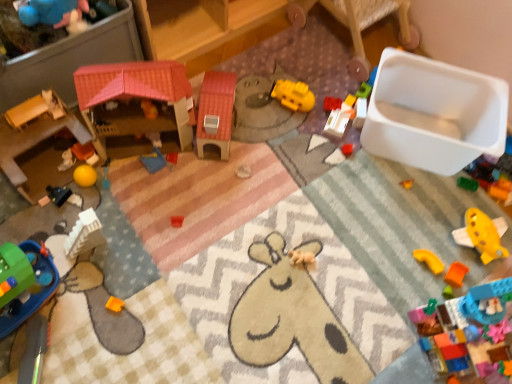
At what (x,y) coordinates should I click in order to perform the action: click on free space that is in between plastic pink house at center, positioned as the 9th toy in right-to-left order, and white plastic container at center, acting as the 10th toy starting from the left. Please return your answer as a coordinate pair (x, y). Looking at the image, I should click on (273, 135).